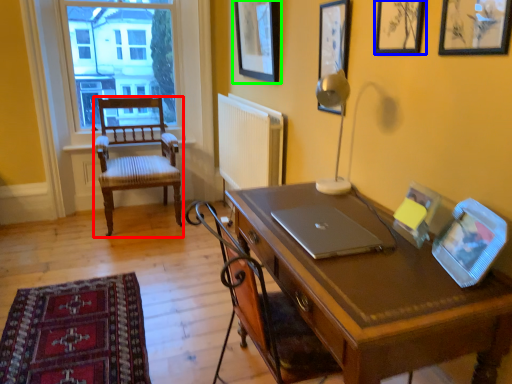
Question: Which object is positioned closest to chair (highlighted by a red box)? Select from picture frame (highlighted by a blue box) and picture frame (highlighted by a green box).

Choices:
 (A) picture frame
 (B) picture frame

Answer: (B)